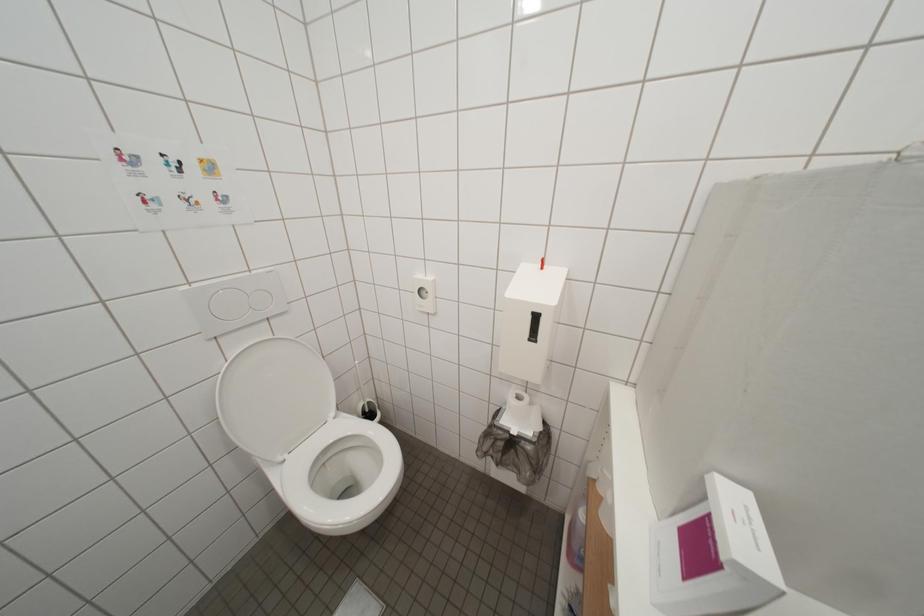
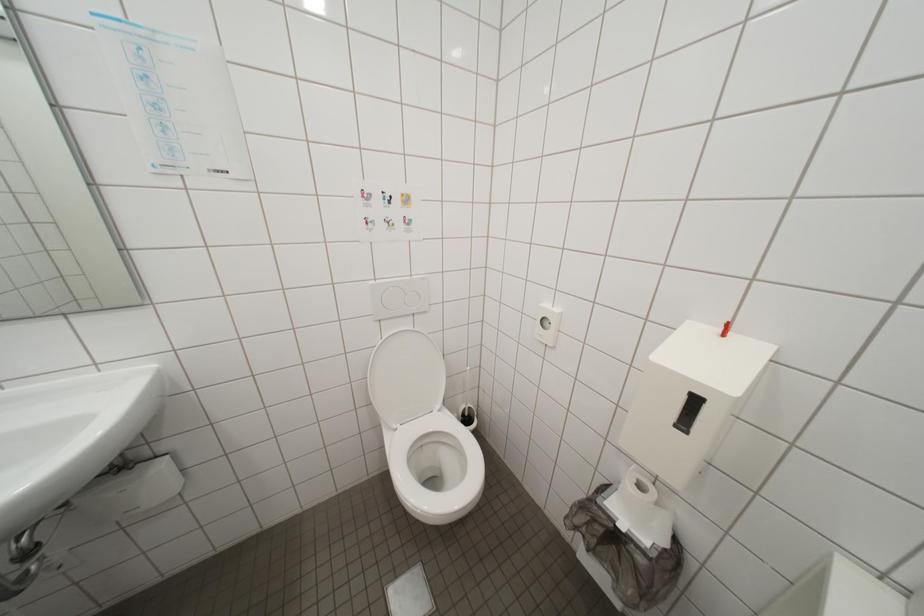
Question: The first image is from the beginning of the video and the second image is from the end. How did the camera likely rotate when shooting the video?

Choices:
 (A) Left
 (B) Right
 (C) Up
 (D) Down

Answer: (A)